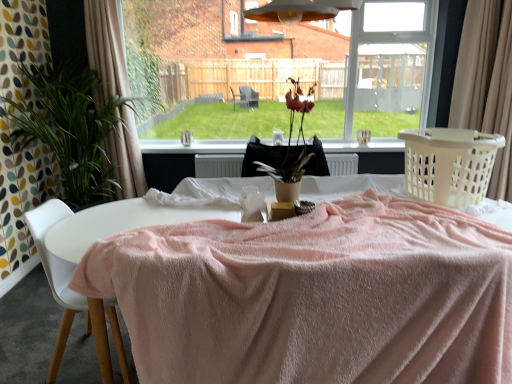
Question: From the image's perspective, is black fabric at center under beige fabric curtain at left, the second curtain when ordered from right to left?

Choices:
 (A) no
 (B) yes

Answer: (B)

Question: Can you confirm if black fabric at center is thinner than beige fabric curtain at left, the second curtain when ordered from right to left?

Choices:
 (A) no
 (B) yes

Answer: (B)

Question: Considering the relative positions of black fabric at center and beige fabric curtain at left, placed as the first curtain when sorted from left to right, in the image provided, is black fabric at center to the right of beige fabric curtain at left, placed as the first curtain when sorted from left to right, from the viewer's perspective?

Choices:
 (A) yes
 (B) no

Answer: (A)

Question: Is black fabric at center in front of beige fabric curtain at left, placed as the first curtain when sorted from left to right?

Choices:
 (A) no
 (B) yes

Answer: (A)

Question: Is black fabric at center located outside beige fabric curtain at left, placed as the first curtain when sorted from left to right?

Choices:
 (A) no
 (B) yes

Answer: (B)

Question: From the image's perspective, relative to transparent glass window at center, is beige fabric curtain at left, placed as the first curtain when sorted from left to right, above or below?

Choices:
 (A) above
 (B) below

Answer: (B)

Question: In terms of height, does beige fabric curtain at left, the second curtain when ordered from right to left, look taller or shorter compared to transparent glass window at center?

Choices:
 (A) tall
 (B) short

Answer: (A)

Question: Is beige fabric curtain at left, the second curtain when ordered from right to left, inside the boundaries of transparent glass window at center, or outside?

Choices:
 (A) inside
 (B) outside

Answer: (B)

Question: Based on their sizes in the image, would you say beige fabric curtain at left, the second curtain when ordered from right to left, is bigger or smaller than transparent glass window at center?

Choices:
 (A) small
 (B) big

Answer: (A)

Question: Looking at their shapes, would you say matte brown vase at center is wider or thinner than beige fabric curtain at left, placed as the first curtain when sorted from left to right?

Choices:
 (A) thin
 (B) wide

Answer: (A)

Question: Is point [x=258, y=162] closer or farther from the camera than point [x=133, y=190]?

Choices:
 (A) farther
 (B) closer

Answer: (B)

Question: In the image, is matte brown vase at center positioned in front of or behind beige fabric curtain at left, placed as the first curtain when sorted from left to right?

Choices:
 (A) behind
 (B) front

Answer: (B)

Question: Is matte brown vase at center inside or outside of beige fabric curtain at left, the second curtain when ordered from right to left?

Choices:
 (A) inside
 (B) outside

Answer: (B)

Question: In terms of height, does green leafy plant at left look taller or shorter compared to beige fabric curtain at left, placed as the first curtain when sorted from left to right?

Choices:
 (A) tall
 (B) short

Answer: (B)

Question: Is point (86, 112) positioned closer to the camera than point (110, 56)?

Choices:
 (A) closer
 (B) farther

Answer: (A)